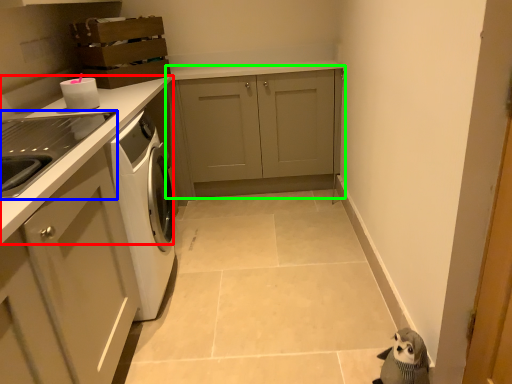
Question: Based on their relative distances, which object is farther from countertop (highlighted by a red box)? Choose from home appliance (highlighted by a blue box) and cabinetry (highlighted by a green box).

Choices:
 (A) home appliance
 (B) cabinetry

Answer: (B)